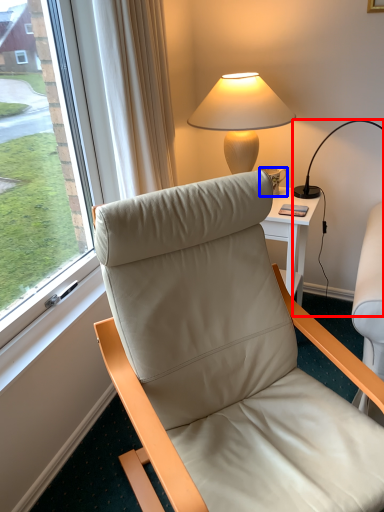
Question: Which object is further to the camera taking this photo, lamp (highlighted by a red box) or coffee cup (highlighted by a blue box)?

Choices:
 (A) lamp
 (B) coffee cup

Answer: (B)